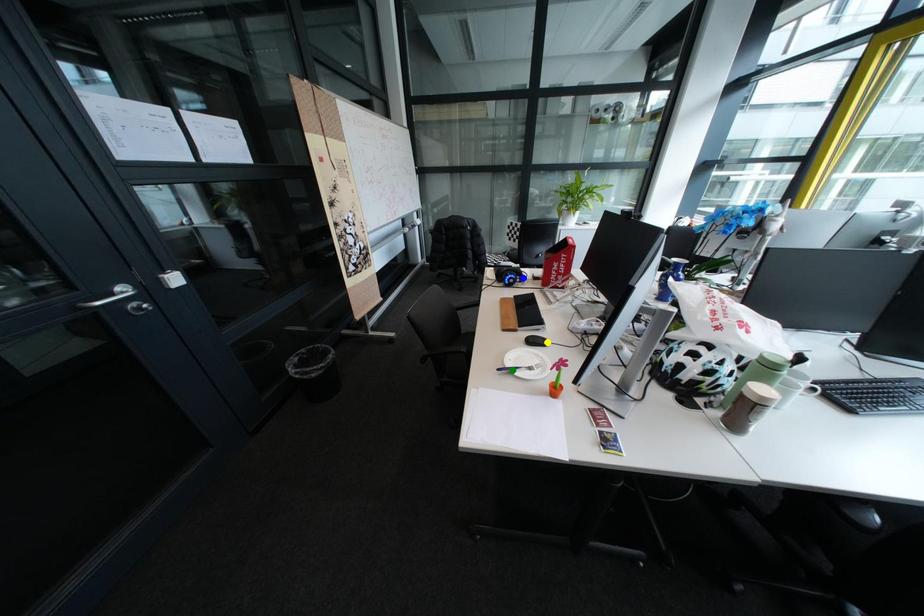
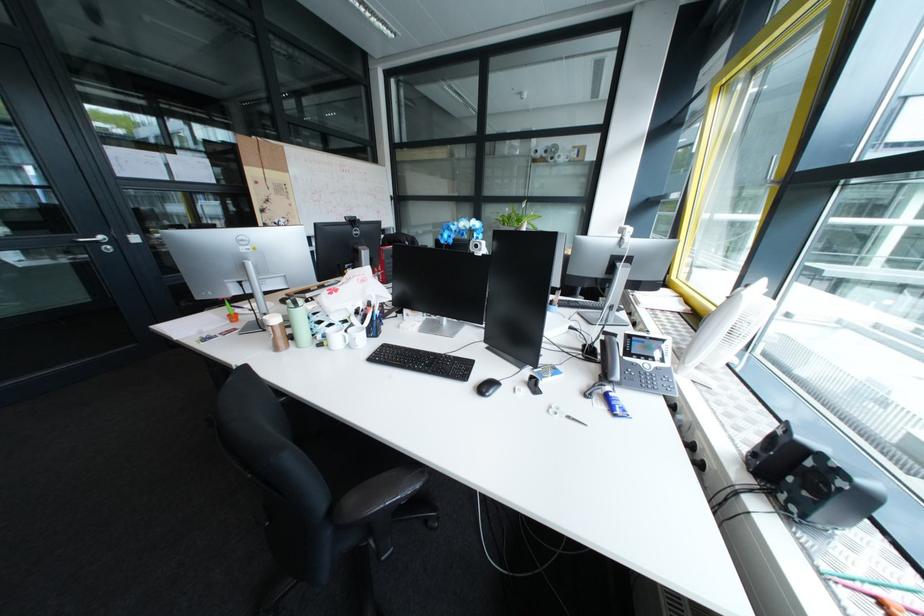
I am providing you with two images of the same scene from different viewpoints. Three points are marked in image1. Which point corresponds to a part or object that is occluded in image2?In image1, three points are marked. Which of them correspond to a part or object that is occluded in image2?Among the three points shown in image1, which one corresponds to a part or object that is no longer visible due to occlusion in image2?

green point, yellow point, blue point cannot be seen in image2.